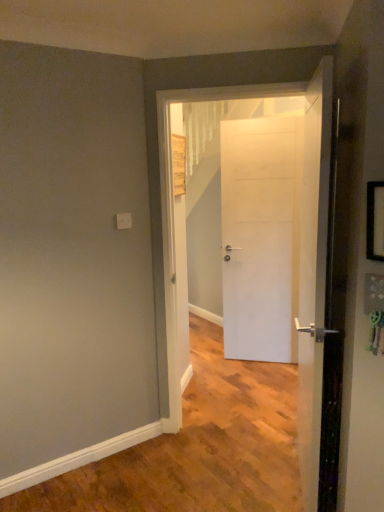
Question: Considering the relative sizes of white matte door at center, positioned as the 1th door in back-to-front order, and white matte door at center, acting as the 2th door starting from the back, in the image provided, is white matte door at center, positioned as the 1th door in back-to-front order, bigger than white matte door at center, acting as the 2th door starting from the back,?

Choices:
 (A) yes
 (B) no

Answer: (B)

Question: Is white matte door at center, positioned as the 1th door in back-to-front order, in contact with white matte door at center, arranged as the 2th door when viewed from the front?

Choices:
 (A) yes
 (B) no

Answer: (B)

Question: From a real-world perspective, is white matte door at center, positioned as the 1th door in back-to-front order, located beneath white matte door at center, acting as the 2th door starting from the back?

Choices:
 (A) no
 (B) yes

Answer: (B)

Question: Does white matte door at center, positioned as the 1th door in back-to-front order, have a lesser width compared to white matte door at center, arranged as the 2th door when viewed from the front?

Choices:
 (A) no
 (B) yes

Answer: (B)

Question: From the image's perspective, is white matte door at center, arranged as the 3th door when viewed from the front, beneath white matte door at center, acting as the 2th door starting from the back?

Choices:
 (A) yes
 (B) no

Answer: (B)

Question: Can you confirm if white matte door at center, positioned as the 1th door in back-to-front order, is smaller than white matte door at center, arranged as the 2th door when viewed from the front?

Choices:
 (A) yes
 (B) no

Answer: (A)

Question: Is white matte door at center, arranged as the 2th door when viewed from the front, beside black plastic picture frame at right?

Choices:
 (A) yes
 (B) no

Answer: (B)

Question: Is white matte door at center, arranged as the 2th door when viewed from the front, shorter than black plastic picture frame at right?

Choices:
 (A) yes
 (B) no

Answer: (B)

Question: Is white matte door at center, arranged as the 2th door when viewed from the front, positioned behind black plastic picture frame at right?

Choices:
 (A) no
 (B) yes

Answer: (B)

Question: From the image's perspective, is white matte door at center, arranged as the 2th door when viewed from the front, beneath black plastic picture frame at right?

Choices:
 (A) yes
 (B) no

Answer: (A)

Question: Does white matte door at center, arranged as the 2th door when viewed from the front, have a smaller size compared to black plastic picture frame at right?

Choices:
 (A) yes
 (B) no

Answer: (B)

Question: Is white matte door at center, arranged as the 2th door when viewed from the front, not close to black plastic picture frame at right?

Choices:
 (A) yes
 (B) no

Answer: (A)

Question: Is black plastic picture frame at right facing towards white matte door at center, positioned as the 3th door in back-to-front order?

Choices:
 (A) yes
 (B) no

Answer: (B)